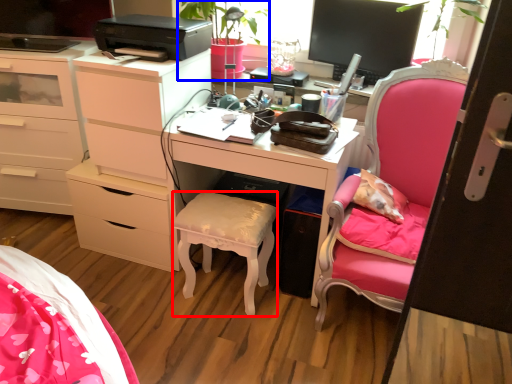
Question: Which object appears closest to the camera in this image, stool (highlighted by a red box) or houseplant (highlighted by a blue box)?

Choices:
 (A) stool
 (B) houseplant

Answer: (A)